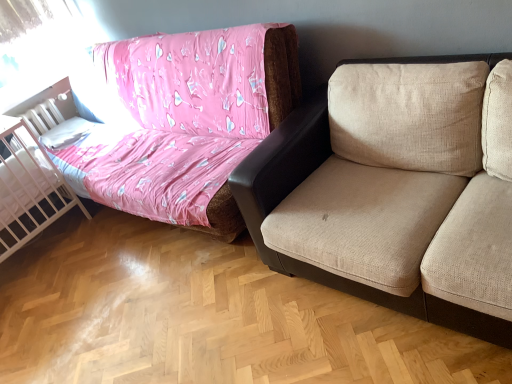
Locate an element on the screen. The width and height of the screenshot is (512, 384). vacant space in front of beige fabric studio couch at upper right is located at coordinates 166,309.